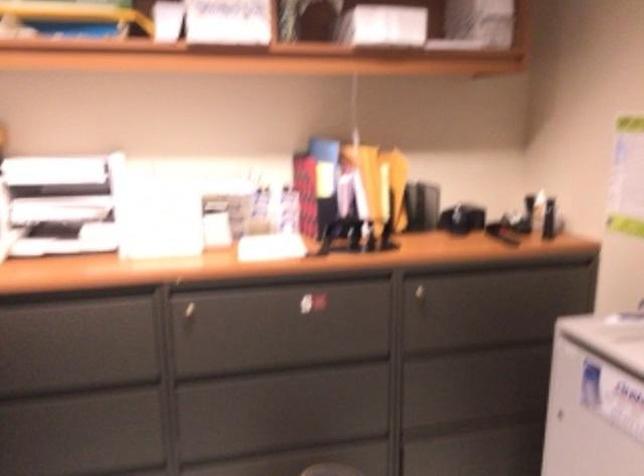
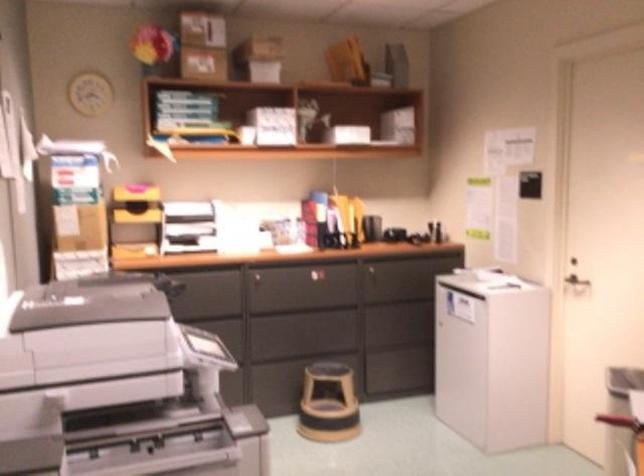
Question: Which direction would the cameraman need to move to produce the second image? Reply with the corresponding letter.

Choices:
 (A) Left
 (B) Right
 (C) Forward
 (D) Backward

Answer: (D)